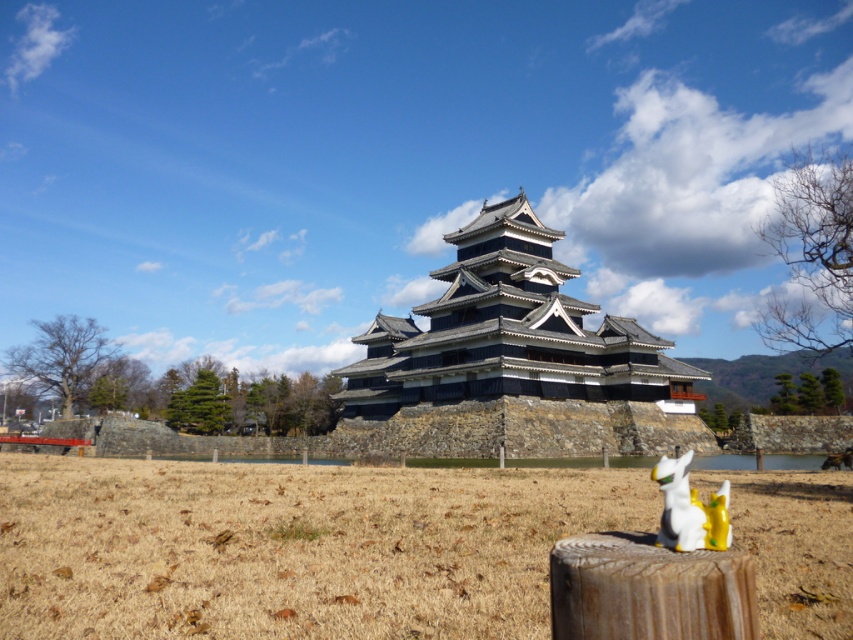
This screenshot has width=853, height=640. What do you see at coordinates (517, 360) in the screenshot?
I see `dark gray stone fort at center` at bounding box center [517, 360].

Is the position of dark gray stone fort at center less distant than that of white glossy statue at lower right?

No, dark gray stone fort at center is behind white glossy statue at lower right.

You are a GUI agent. You are given a task and a screenshot of the screen. Output one action in this format:
    pyautogui.click(x=<x>, y=<y>)
    Task: Click on the dark gray stone fort at center
    
    Given the screenshot: What is the action you would take?
    pyautogui.click(x=517, y=360)

I want to click on dark gray stone fort at center, so click(517, 360).

Does brown wood stump at lower center lie behind white glossy statue at lower right?

No, it is not.

Can you confirm if brown wood stump at lower center is positioned to the left of white glossy statue at lower right?

Correct, you'll find brown wood stump at lower center to the left of white glossy statue at lower right.

Between point (595, 572) and point (714, 536), which one is positioned in front?

Point (595, 572) is more forward.

Image resolution: width=853 pixels, height=640 pixels. I want to click on brown wood stump at lower center, so click(x=648, y=589).

Does point (271, 545) come behind point (683, 500)?

Yes, it is.

Is brown grass at center taller than white glossy statue at lower right?

No.

This screenshot has width=853, height=640. Find the location of `brown grass at center`. brown grass at center is located at coordinates (292, 547).

Where is `brown grass at center`? This screenshot has height=640, width=853. brown grass at center is located at coordinates (292, 547).